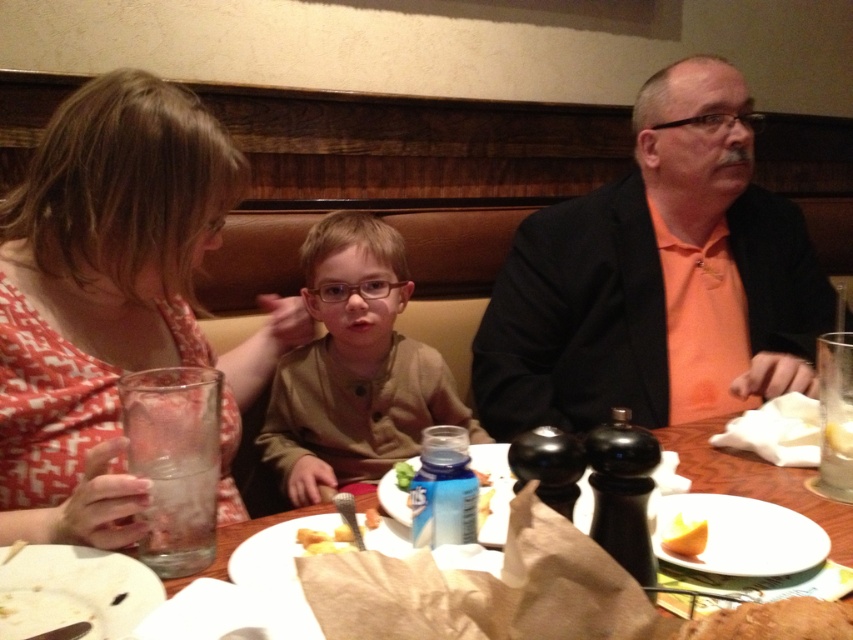
Question: Does yellowish matte bread at center appear over yellow matte cheese at plate center?

Choices:
 (A) yes
 (B) no

Answer: (A)

Question: Which point is closer to the camera taking this photo?

Choices:
 (A) (732, 624)
 (B) (485, 483)
 (C) (550, 276)
 (D) (663, 538)

Answer: (A)

Question: Which point is closer to the camera?

Choices:
 (A) yellow sponge at center
 (B) orange matte jacket at upper right

Answer: (A)

Question: Which point is farther from the camera taking this photo?

Choices:
 (A) (666, 534)
 (B) (376, 525)

Answer: (B)

Question: From the image, what is the correct spatial relationship of blue plastic bottle at center in relation to yellow matte cheese at plate center?

Choices:
 (A) left
 (B) right

Answer: (A)

Question: Does brown crumbly bread at lower right have a greater width compared to yellow sponge at center?

Choices:
 (A) yes
 (B) no

Answer: (A)